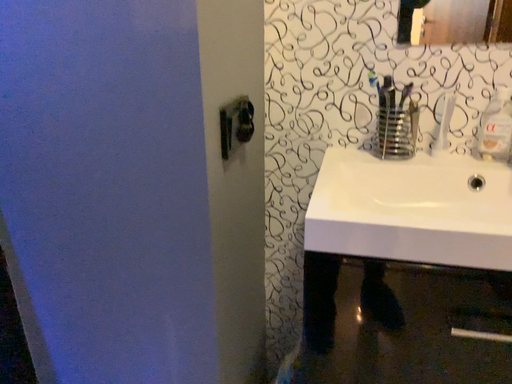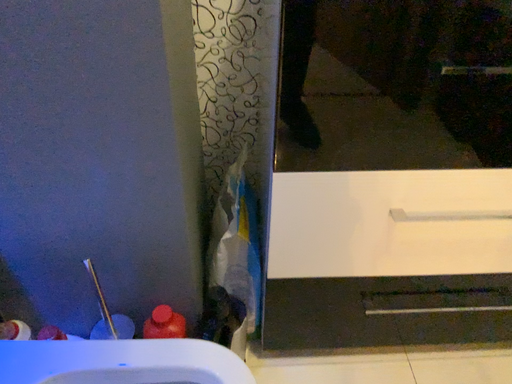
Question: Which way did the camera rotate in the video?

Choices:
 (A) rotated downward
 (B) rotated upward

Answer: (A)